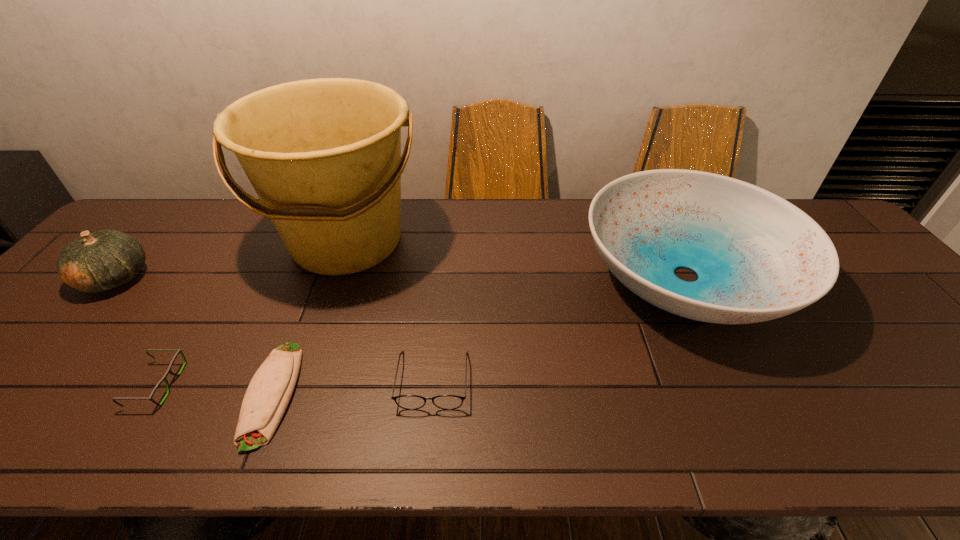
Find the location of a particular element. The image size is (960, 540). vacant space located 0.070m on the front of the gourd is located at coordinates (76, 323).

You are a GUI agent. You are given a task and a screenshot of the screen. Output one action in this format:
    pyautogui.click(x=<x>, y=<y>)
    Task: Click on the free location located 0.050m on the front-facing side of the taller spectacles
    This screenshot has height=540, width=960.
    Given the screenshot: What is the action you would take?
    [428, 434]

The height and width of the screenshot is (540, 960). What are the coordinates of `vacant area situated 0.260m on the lens of the left spectacles` in the screenshot? It's located at (295, 384).

Locate an element on the screen. bucket present at the far edge is located at coordinates (324, 156).

You are a GUI agent. You are given a task and a screenshot of the screen. Output one action in this format:
    pyautogui.click(x=<x>, y=<y>)
    Task: Click on the dish that is positioned at the far edge
    
    Given the screenshot: What is the action you would take?
    pyautogui.click(x=758, y=257)

Find the location of a particular element. object present at the near edge is located at coordinates pos(268,394).

I want to click on object located at the left edge, so click(95, 262).

Locate an element on the screen. vacant space at the far edge of the desktop is located at coordinates (439, 213).

Locate an element on the screen. free space at the near edge is located at coordinates (729, 449).

You are a GUI agent. You are given a task and a screenshot of the screen. Output one action in this format:
    pyautogui.click(x=<x>, y=<y>)
    Task: Click on the vacant region at the right edge of the desktop
    The image size is (960, 540).
    Given the screenshot: What is the action you would take?
    pyautogui.click(x=872, y=279)